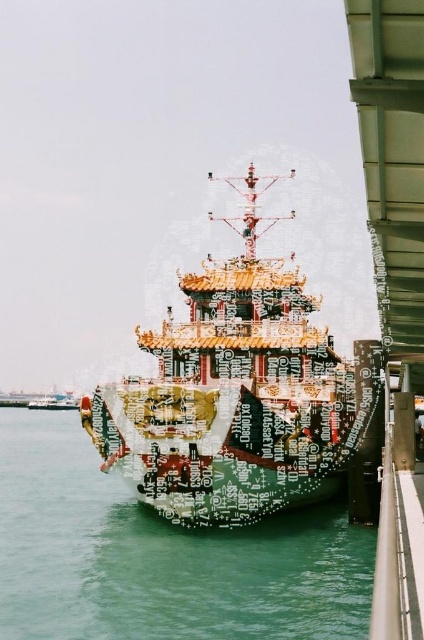
Question: Can you confirm if green glossy water at center is wider than gold lacquered ship at center?

Choices:
 (A) no
 (B) yes

Answer: (B)

Question: Can you confirm if green glossy water at center is positioned to the right of gold lacquered ship at center?

Choices:
 (A) no
 (B) yes

Answer: (A)

Question: Among these objects, which one is farthest from the camera?

Choices:
 (A) green glossy water at center
 (B) gold lacquered ship at center

Answer: (B)

Question: Which object is farther from the camera taking this photo?

Choices:
 (A) gold lacquered ship at center
 (B) green glossy water at center

Answer: (A)

Question: Does green glossy water at center have a greater width compared to gold lacquered ship at center?

Choices:
 (A) yes
 (B) no

Answer: (A)